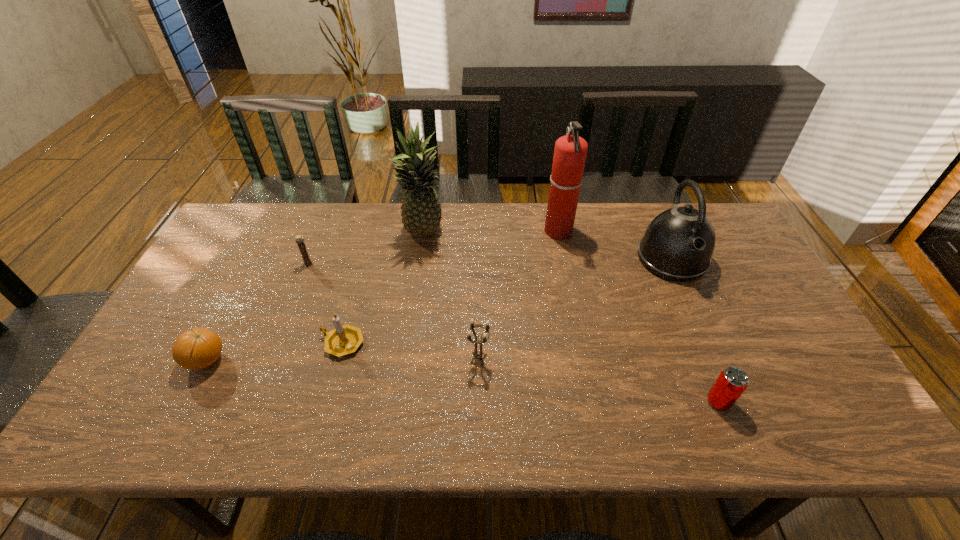
You are a GUI agent. You are given a task and a screenshot of the screen. Output one action in this format:
    pyautogui.click(x=<x>, y=<y>)
    Task: Click on the pineapple positioned at the far edge
    
    Given the screenshot: What is the action you would take?
    pyautogui.click(x=421, y=210)

Where is `kettle situated at the far edge`? This screenshot has width=960, height=540. kettle situated at the far edge is located at coordinates (678, 244).

Image resolution: width=960 pixels, height=540 pixels. Find the location of `object at the near edge`. object at the near edge is located at coordinates (731, 383).

Locate an element on the screen. object present at the left edge is located at coordinates (198, 348).

This screenshot has height=540, width=960. I want to click on object located at the right edge, so click(678, 244).

Locate an element on the screen. The width and height of the screenshot is (960, 540). object at the far right corner is located at coordinates (678, 244).

Identify the location of vacant space at the far edge of the desktop. (315, 217).

This screenshot has height=540, width=960. In the image, there is a desktop. Identify the location of vacant space at the near edge. (618, 438).

This screenshot has width=960, height=540. Find the location of `free space at the left edge`. free space at the left edge is located at coordinates (245, 285).

Identify the location of vacant space at the right edge. (747, 328).